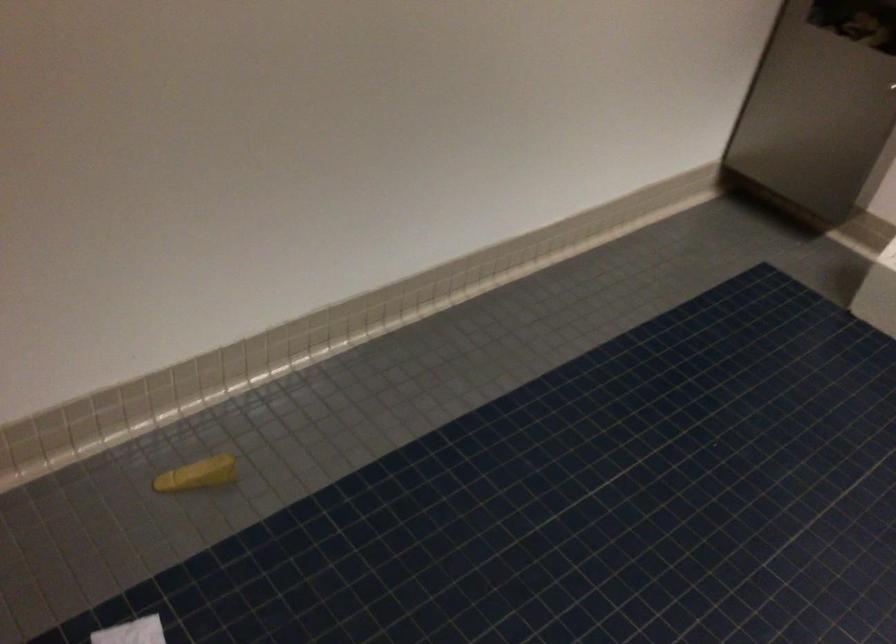
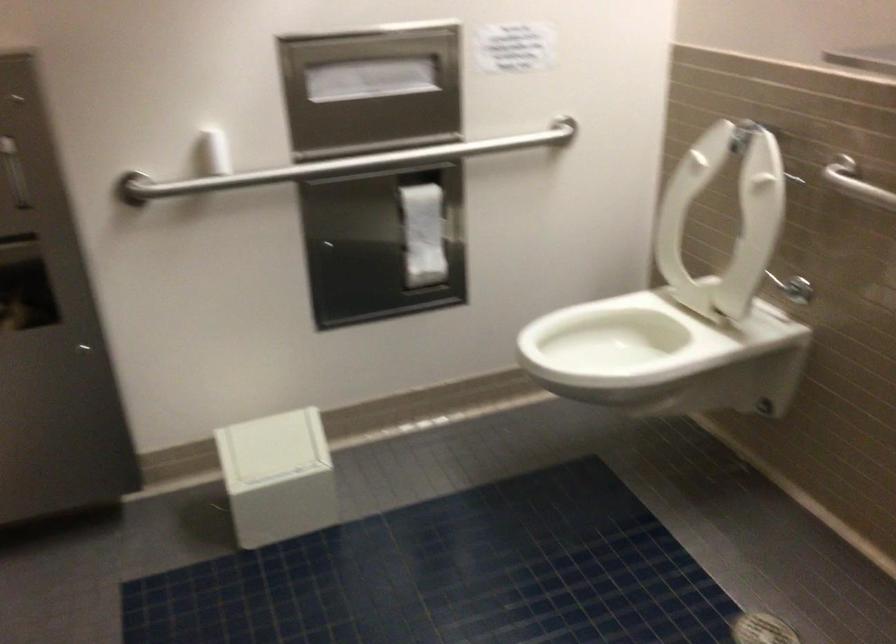
Question: How did the camera likely rotate?

Choices:
 (A) Left
 (B) Right
 (C) Up
 (D) Down

Answer: (B)